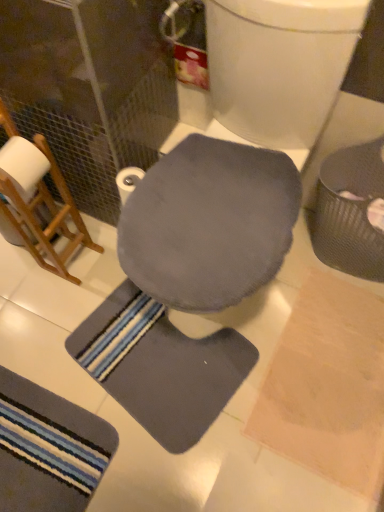
This screenshot has height=512, width=384. Find the location of `free point above striped fabric bath mat at lower left, positioned as the second bath mat in right-to-left order (from a real-world perspective)`. free point above striped fabric bath mat at lower left, positioned as the second bath mat in right-to-left order (from a real-world perspective) is located at coordinates (39, 446).